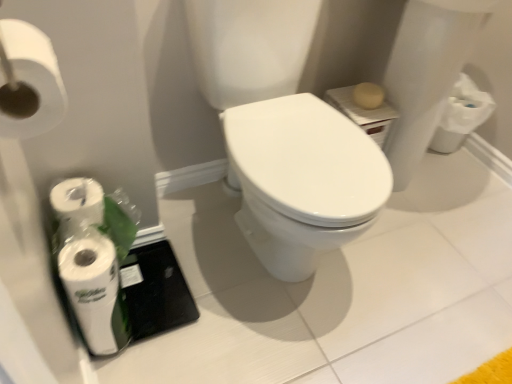
Where is `free space to the right of white matte toilet paper at lower left, the 1th toilet paper when ordered from left to right`? free space to the right of white matte toilet paper at lower left, the 1th toilet paper when ordered from left to right is located at coordinates [x=180, y=332].